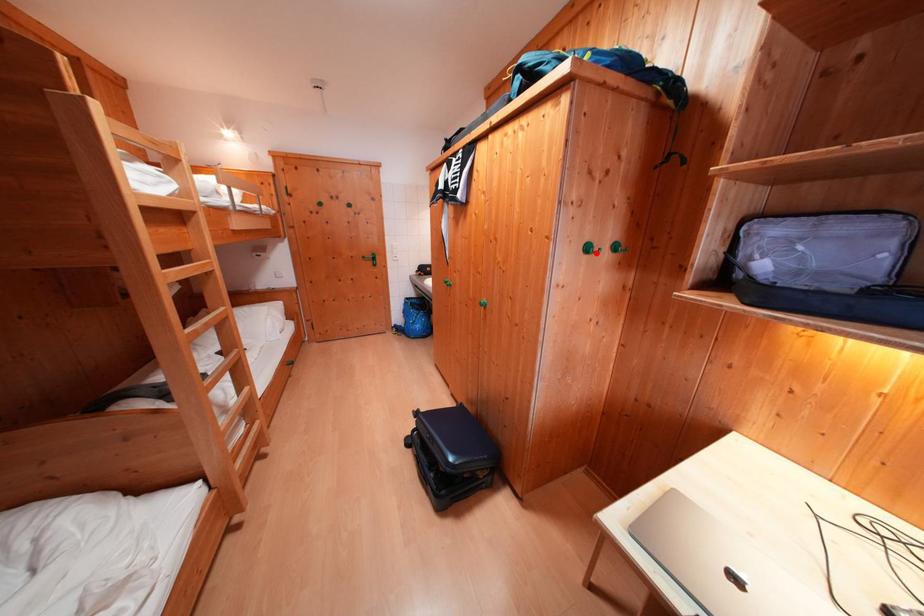
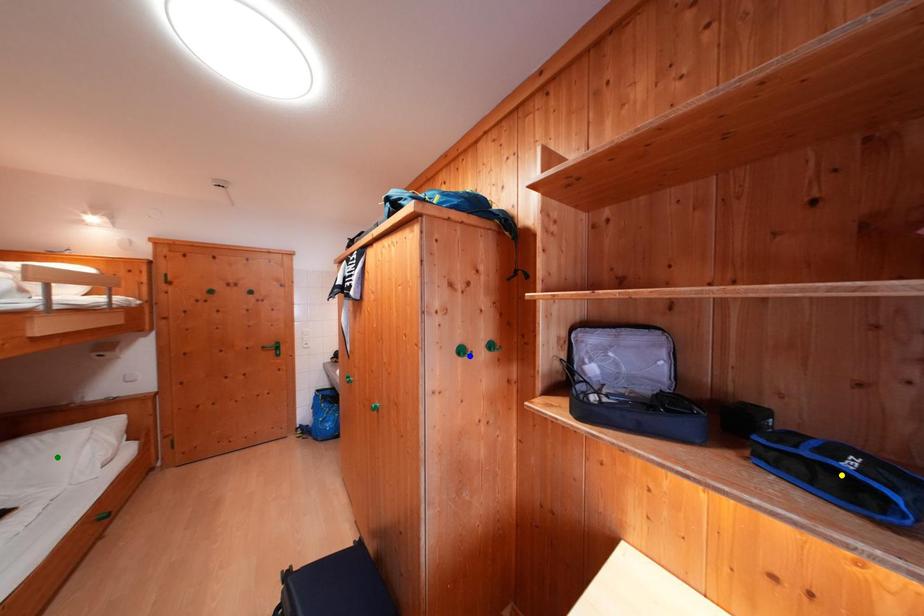
Question: I am providing you with two images of the same scene from different viewpoints. A red point is marked on the first image. You are given multiple points on the second image. Can you choose the point in image 2 that corresponds to the point in image 1?

Choices:
 (A) blue point
 (B) yellow point
 (C) green point

Answer: (A)